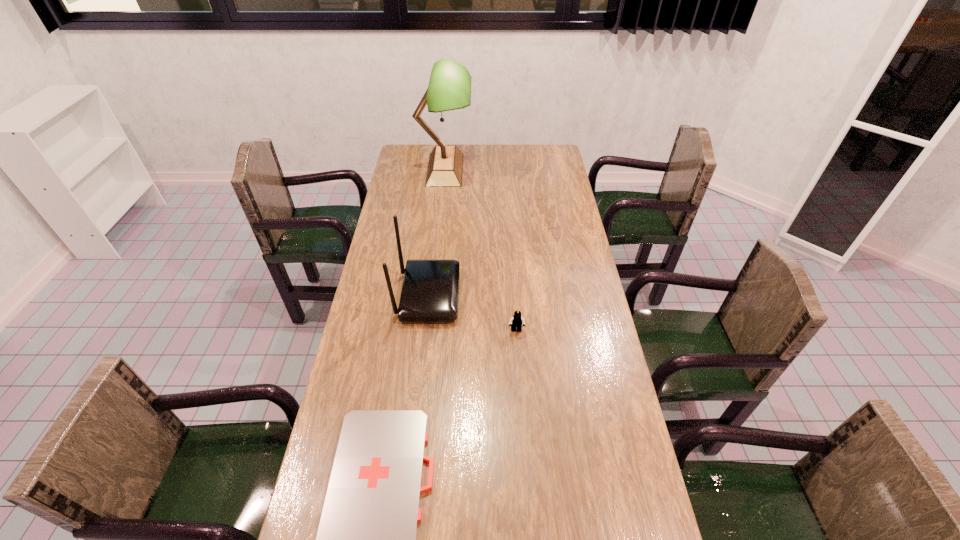
Locate an element on the screen. The image size is (960, 540). the tallest object is located at coordinates (x=449, y=88).

Find the location of a particular element. The width and height of the screenshot is (960, 540). the farthest object is located at coordinates (449, 88).

In order to click on the second farthest object in this screenshot , I will do `click(430, 290)`.

Identify the location of the second tallest object. Image resolution: width=960 pixels, height=540 pixels. (430, 290).

Find the location of a particular element. The image size is (960, 540). the third farthest object is located at coordinates (516, 321).

I want to click on the rightmost object, so click(x=516, y=321).

Locate an element on the screen. free space located on the metallic stand of the table lamp is located at coordinates (534, 170).

Identify the location of vacant space located 0.330m on the front-facing side of the second farthest object. (555, 295).

This screenshot has width=960, height=540. Identify the location of blank space located on the front-facing side of the rightmost object. (520, 381).

Where is `object that is at the far edge`? object that is at the far edge is located at coordinates (449, 88).